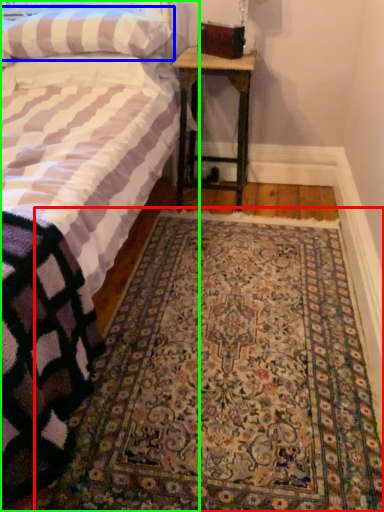
Question: Considering the real-world distances, which object is farthest from mat (highlighted by a red box)? pillow (highlighted by a blue box) or bed (highlighted by a green box)?

Choices:
 (A) pillow
 (B) bed

Answer: (A)